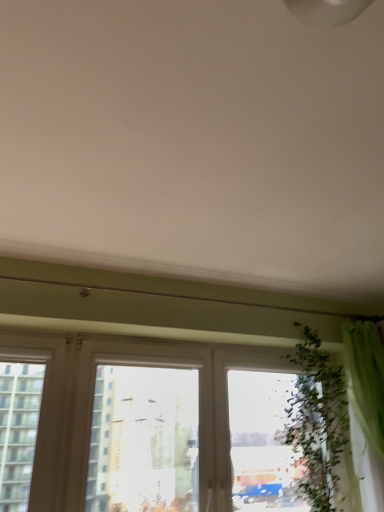
Question: From a real-world perspective, is transparent glass window at center under green leafy plant at right?

Choices:
 (A) no
 (B) yes

Answer: (B)

Question: Does transparent glass window at center have a lesser width compared to green leafy plant at right?

Choices:
 (A) no
 (B) yes

Answer: (B)

Question: Is transparent glass window at center to the right of green leafy plant at right from the viewer's perspective?

Choices:
 (A) no
 (B) yes

Answer: (A)

Question: Is transparent glass window at center turned away from green leafy plant at right?

Choices:
 (A) no
 (B) yes

Answer: (B)

Question: Considering the relative sizes of transparent glass window at center and green leafy plant at right in the image provided, is transparent glass window at center wider than green leafy plant at right?

Choices:
 (A) yes
 (B) no

Answer: (B)

Question: Can you confirm if transparent glass window at center is taller than green leafy plant at right?

Choices:
 (A) yes
 (B) no

Answer: (B)

Question: Considering the relative positions of green leafy plant at right and green fabric curtain at right in the image provided, is green leafy plant at right to the left of green fabric curtain at right from the viewer's perspective?

Choices:
 (A) yes
 (B) no

Answer: (A)

Question: Does green leafy plant at right have a smaller size compared to green fabric curtain at right?

Choices:
 (A) no
 (B) yes

Answer: (B)

Question: Does green leafy plant at right have a lesser width compared to green fabric curtain at right?

Choices:
 (A) yes
 (B) no

Answer: (B)

Question: Can you confirm if green leafy plant at right is taller than green fabric curtain at right?

Choices:
 (A) yes
 (B) no

Answer: (B)

Question: From the image's perspective, is green leafy plant at right located beneath green fabric curtain at right?

Choices:
 (A) yes
 (B) no

Answer: (A)

Question: Would you say green leafy plant at right is outside green fabric curtain at right?

Choices:
 (A) yes
 (B) no

Answer: (A)

Question: From the image's perspective, is transparent glass window at center beneath green fabric curtain at right?

Choices:
 (A) yes
 (B) no

Answer: (A)